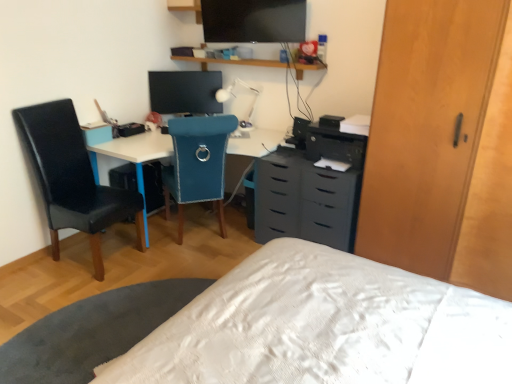
The width and height of the screenshot is (512, 384). Find the location of `empty space that is to the right of black leather chair at left, the first chair in the left-to-right sequence`. empty space that is to the right of black leather chair at left, the first chair in the left-to-right sequence is located at coordinates (154, 278).